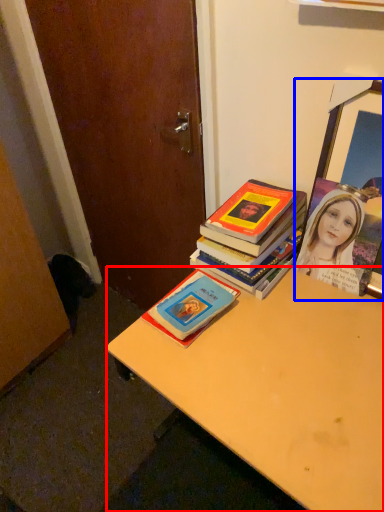
Question: Which of the following is the closest to the observer, desk (highlighted by a red box) or picture frame (highlighted by a blue box)?

Choices:
 (A) desk
 (B) picture frame

Answer: (A)